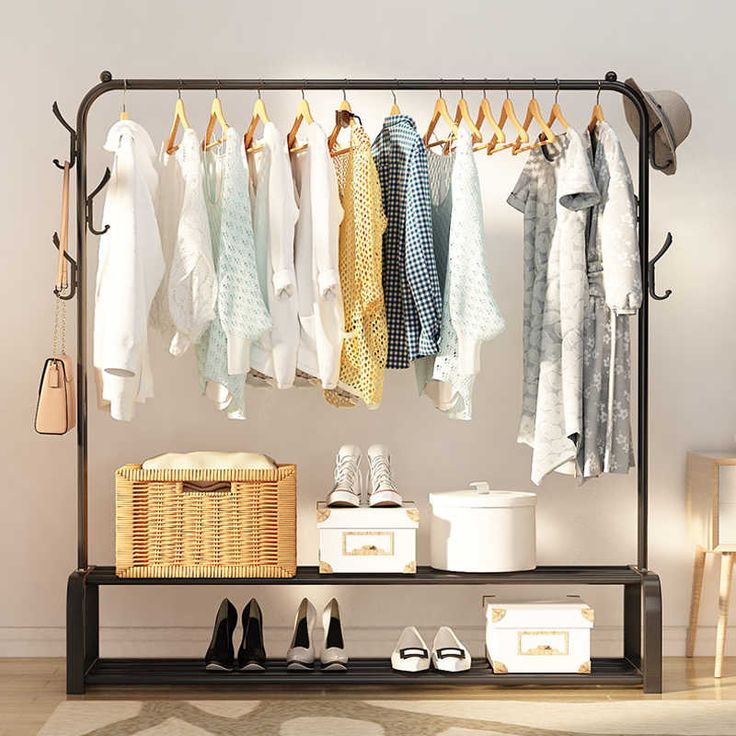
Locate an element on the screen. This screenshot has width=736, height=736. clothes rack feet is located at coordinates (77, 682), (95, 629), (631, 623), (654, 643).